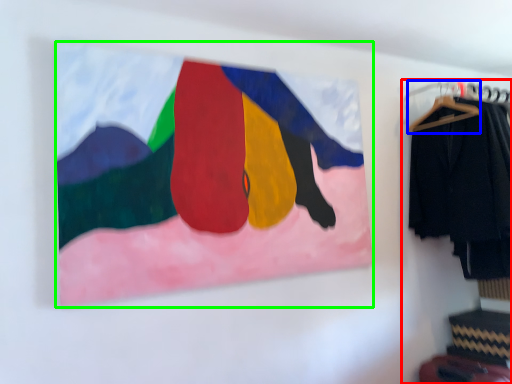
Question: Based on their relative distances, which object is farther from closet (highlighted by a red box)? Choose from hanger (highlighted by a blue box) and picture frame (highlighted by a green box).

Choices:
 (A) hanger
 (B) picture frame

Answer: (B)